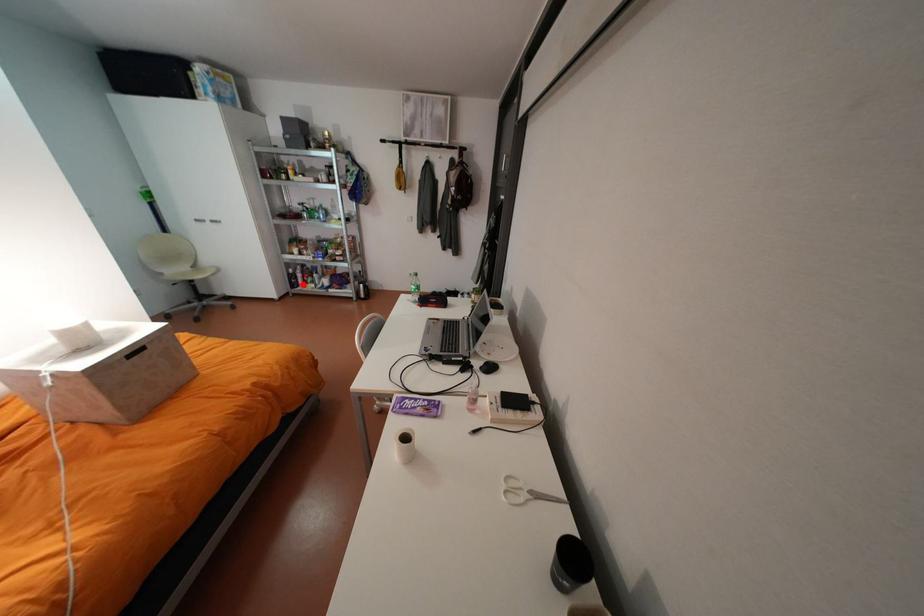
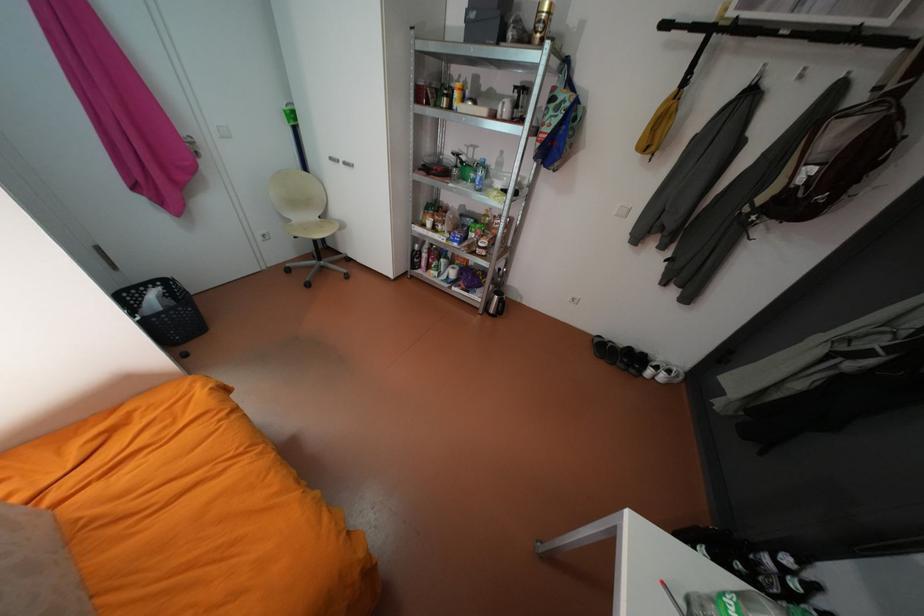
Locate, in the second image, the point that corresponds to the highlighted location in the first image.

(423, 265)